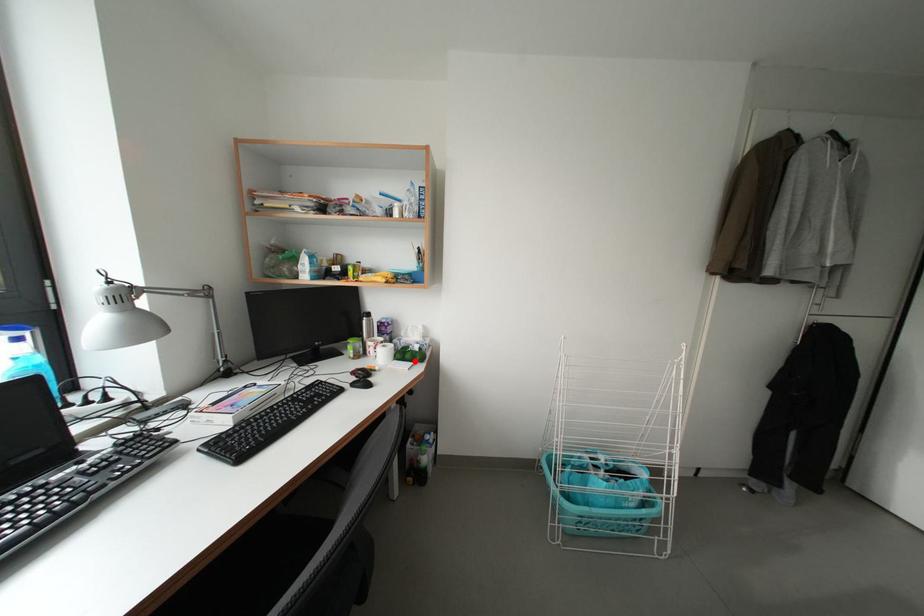
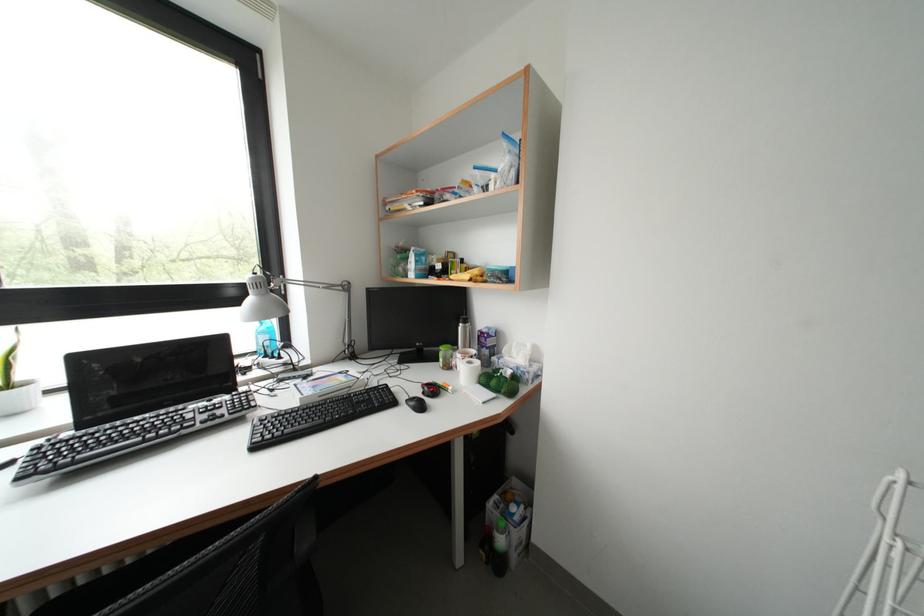
The point at the highlighted location is marked in the first image. Where is the corresponding point in the second image?

(500, 387)